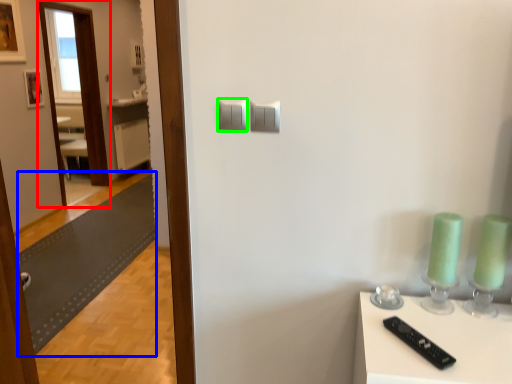
Question: Considering the real-world distances, which object is farthest from glass door (highlighted by a red box)? mat (highlighted by a blue box) or light switch (highlighted by a green box)?

Choices:
 (A) mat
 (B) light switch

Answer: (B)